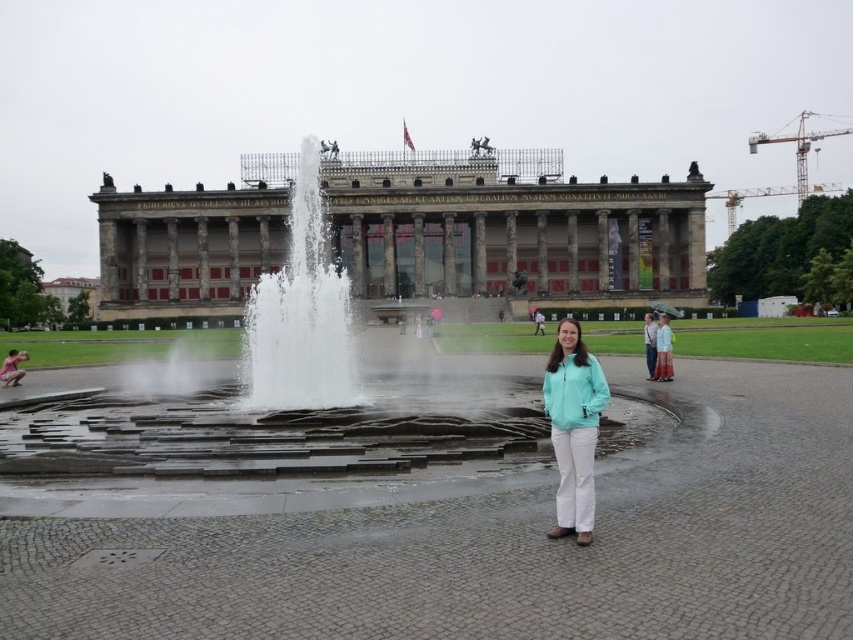
Question: Which of these objects is positioned closest to the teal fabric jacket at center?

Choices:
 (A) marble building at center
 (B) white stone fountain at center

Answer: (A)

Question: Does white stone fountain at center lie in front of teal fabric jacket at center?

Choices:
 (A) yes
 (B) no

Answer: (B)

Question: Which point appears closest to the camera in this image?

Choices:
 (A) (262, 397)
 (B) (556, 376)

Answer: (B)

Question: Among these points, which one is farthest from the camera?

Choices:
 (A) (596, 426)
 (B) (310, 355)

Answer: (B)

Question: Is white stone fountain at center wider than teal fabric jacket at center?

Choices:
 (A) no
 (B) yes

Answer: (B)

Question: Is marble building at center closer to camera compared to white stone fountain at center?

Choices:
 (A) yes
 (B) no

Answer: (B)